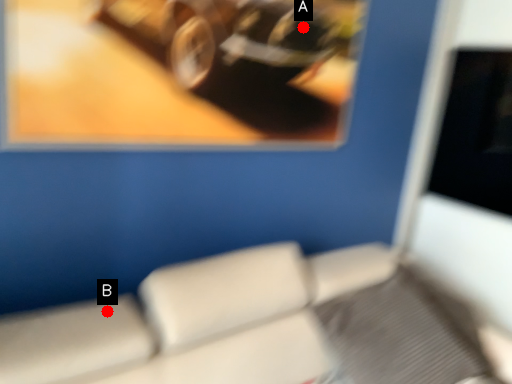
Question: Two points are circled on the image, labeled by A and B beside each circle. Which of the following is the closest to the observer?

Choices:
 (A) A is closer
 (B) B is closer

Answer: (B)